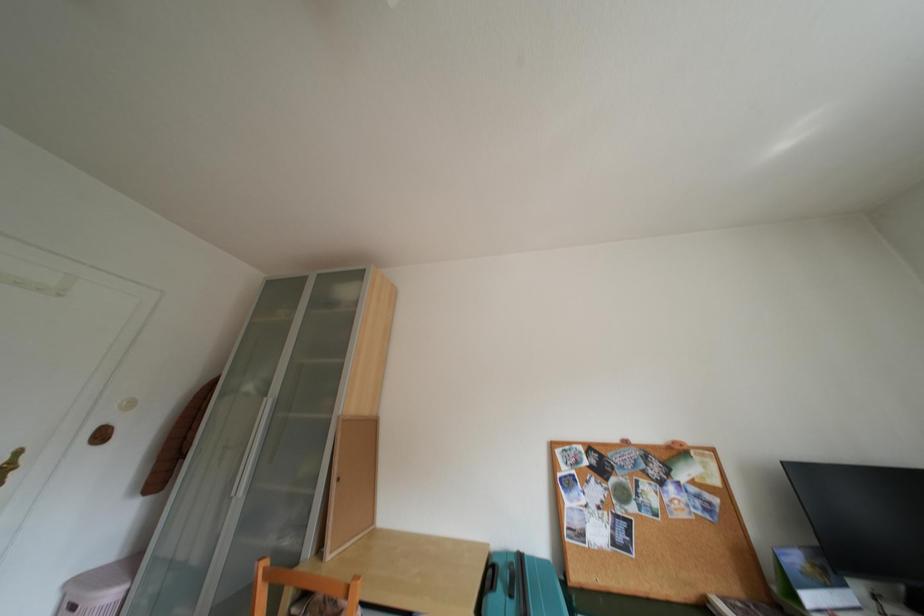
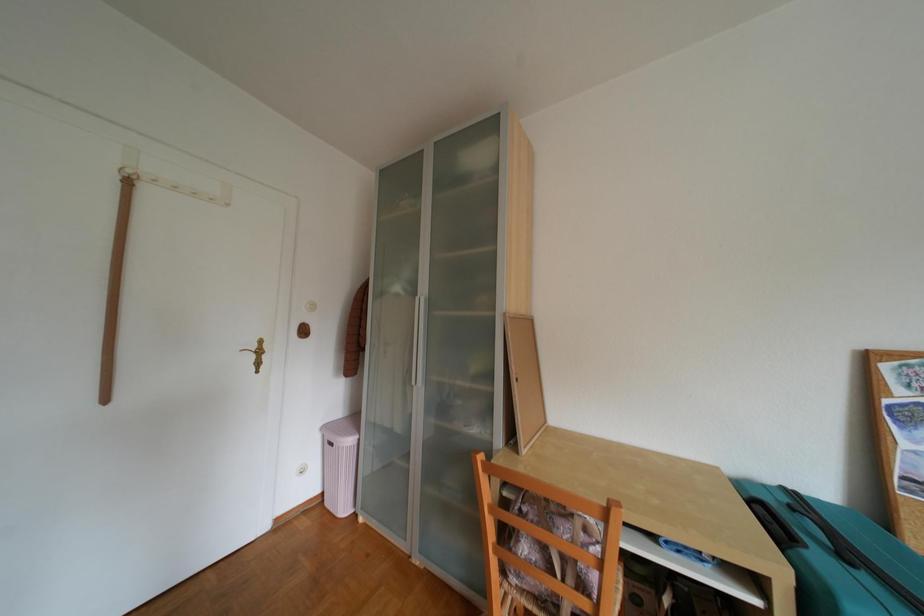
The first image is from the beginning of the video and the second image is from the end. How did the camera likely rotate when shooting the video?

The camera rotated toward left-down.